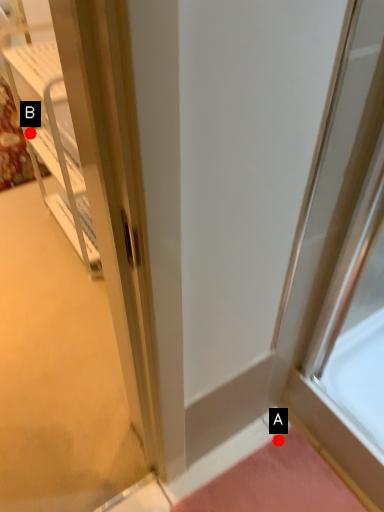
Question: Two points are circled on the image, labeled by A and B beside each circle. Which point is further to the camera?

Choices:
 (A) A is further
 (B) B is further

Answer: (B)